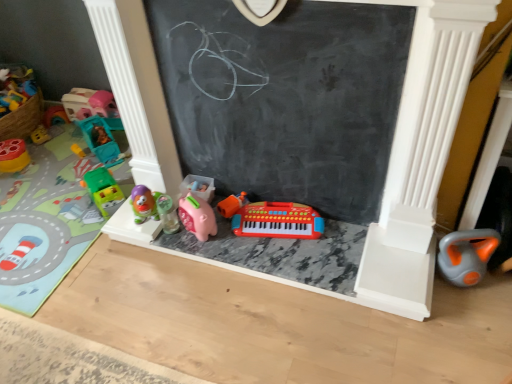
Locate an element on the screen. This screenshot has width=512, height=384. vacant area that is in front of orange rubber toy at lower right, the 8th toy in the left-to-right sequence is located at coordinates (473, 317).